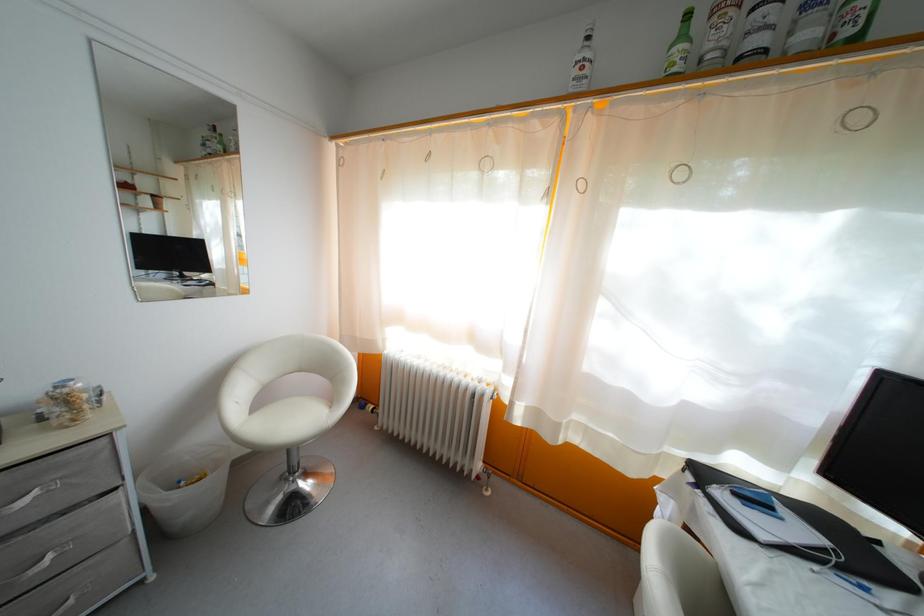
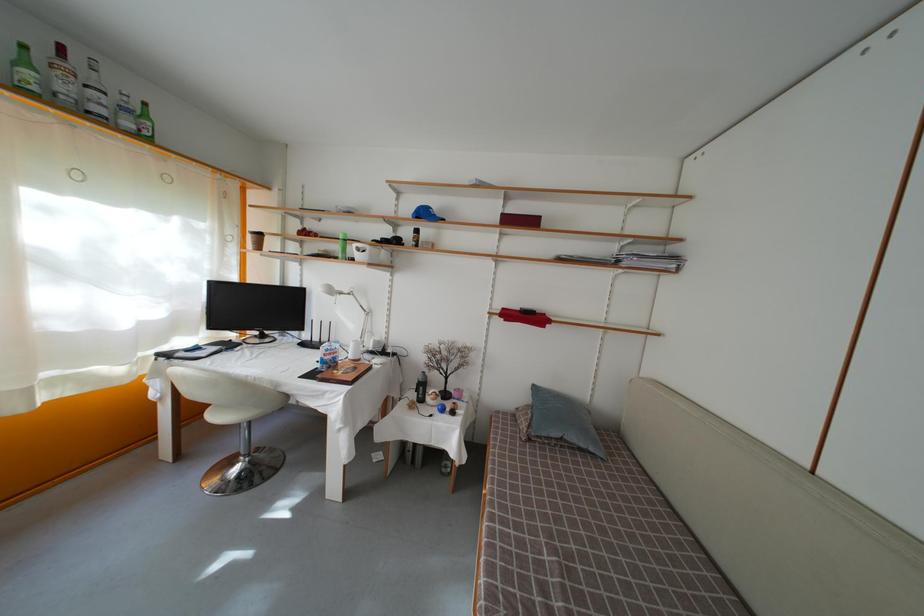
Locate, in the second image, the point that corresponds to point (688, 43) in the first image.

(31, 69)